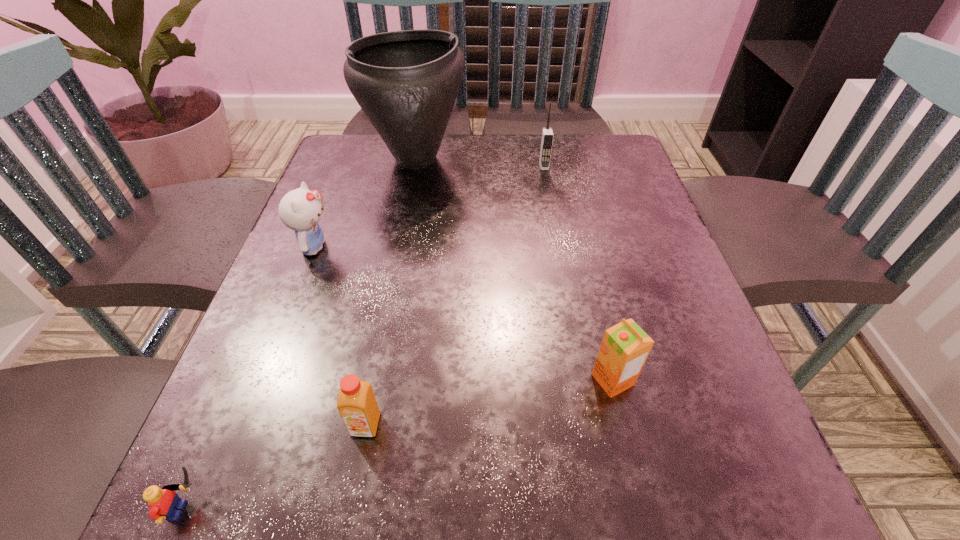
Identify the location of Lego present at the left edge. The width and height of the screenshot is (960, 540). (164, 503).

The height and width of the screenshot is (540, 960). Identify the location of object present at the right edge. (625, 347).

Where is `object that is at the far left corner`? This screenshot has height=540, width=960. object that is at the far left corner is located at coordinates (406, 82).

Identify the location of object that is positioned at the near left corner. The width and height of the screenshot is (960, 540). (164, 503).

The image size is (960, 540). What are the coordinates of `vacant space at the far edge of the desktop` in the screenshot? It's located at (563, 156).

At what (x,y) coordinates should I click in order to perform the action: click on free space at the near edge of the desktop. Please return your answer as a coordinate pair (x, y). The width and height of the screenshot is (960, 540). Looking at the image, I should click on (409, 479).

Find the location of `vacant space at the left edge of the desktop`. vacant space at the left edge of the desktop is located at coordinates (293, 329).

Identify the location of blank space at the right edge. (634, 317).

In the image, there is a desktop. Identify the location of vacant region at the near left corner. (276, 478).

In order to click on vacant area at the far right corner in this screenshot , I will do `click(582, 150)`.